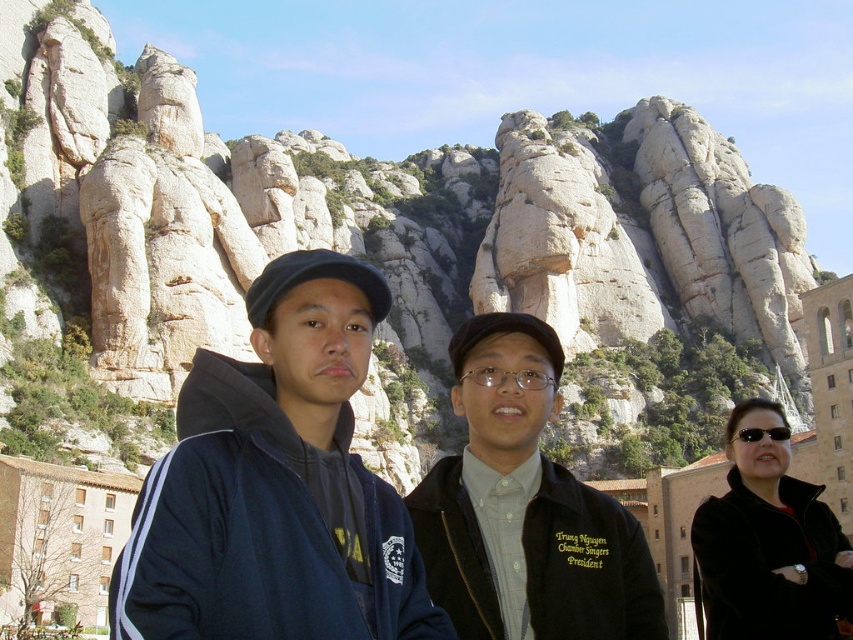
You are a photographer trying to adjust the focus of your camera to capture both the dark blue jacket at center and the black leather jacket at lower right. Which jacket should you focus on first to ensure both are in sharp focus?

The dark blue jacket at center is located above the black leather jacket at lower right, so focusing on the dark blue jacket at center first will help ensure both are in sharp focus as the black leather jacket at lower right is closer to the camera.